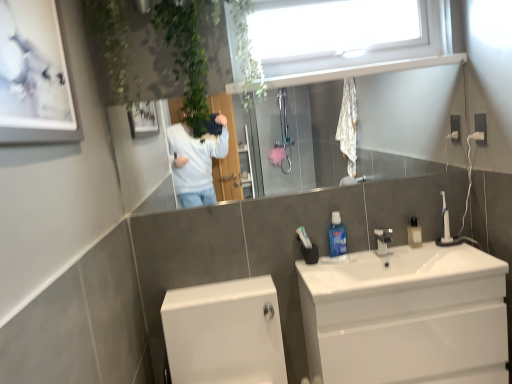
You are a GUI agent. You are given a task and a screenshot of the screen. Output one action in this format:
    pyautogui.click(x=<x>, y=<y>)
    Task: Click on the free space above glossy glass mirror at upper center (from a real-world perspective)
    
    Given the screenshot: What is the action you would take?
    pyautogui.click(x=248, y=82)